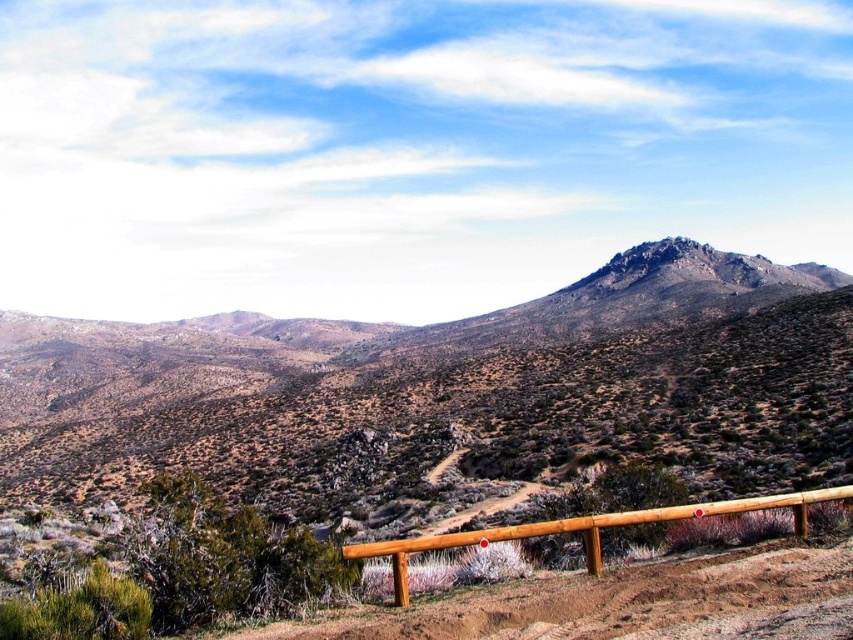
Question: Is the position of brown dirt track at center more distant than that of brown wooden rail at lower center?

Choices:
 (A) no
 (B) yes

Answer: (A)

Question: Which is nearer to the brown dirt track at center?

Choices:
 (A) brown wooden rail at lower center
 (B) brown textured hill at center

Answer: (A)

Question: Is brown dirt track at center above brown wooden rail at lower center?

Choices:
 (A) yes
 (B) no

Answer: (A)

Question: Which object is the farthest from the brown wooden rail at lower center?

Choices:
 (A) brown textured hill at center
 (B) brown dirt track at center

Answer: (A)

Question: Which point is closer to the camera?

Choices:
 (A) (396, 477)
 (B) (724, 637)
 (C) (824, 492)

Answer: (B)

Question: Can you confirm if brown dirt track at center is positioned below brown wooden rail at lower center?

Choices:
 (A) yes
 (B) no

Answer: (B)